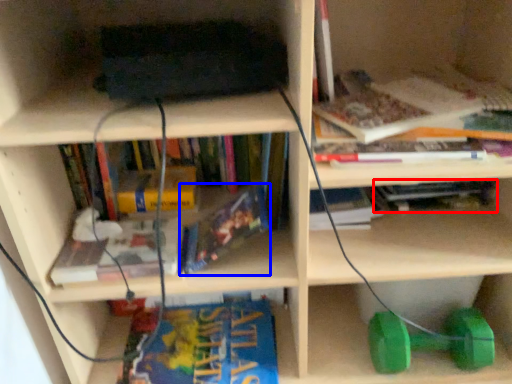
Question: Among these objects, which one is nearest to the camera, book (highlighted by a red box) or book (highlighted by a blue box)?

Choices:
 (A) book
 (B) book

Answer: (B)